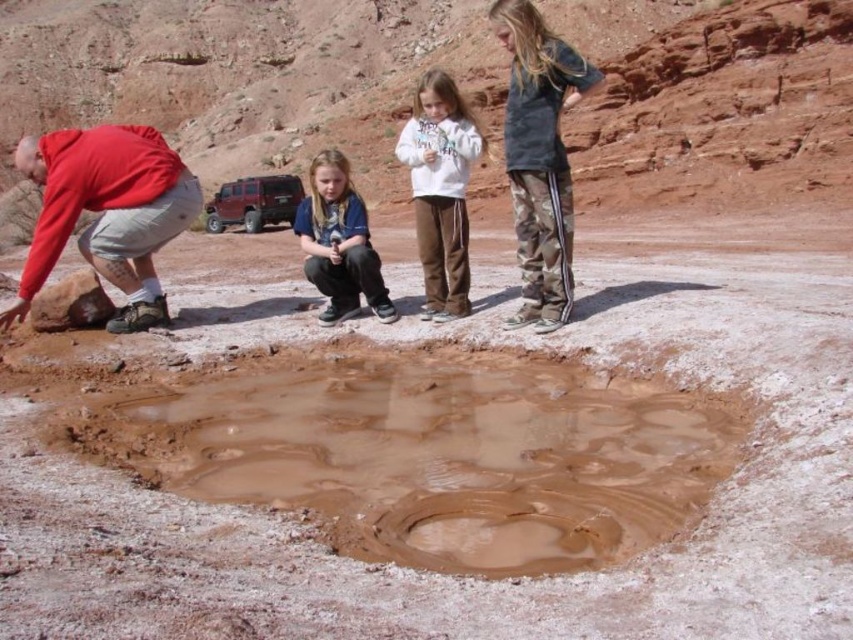
Is red matte shirt at lower left to the right of camo pants at right from the viewer's perspective?

No, red matte shirt at lower left is not to the right of camo pants at right.

Which is below, red matte shirt at lower left or camo pants at right?

red matte shirt at lower left

Which is in front, point (96, 237) or point (544, 64)?

Point (544, 64) is in front.

The width and height of the screenshot is (853, 640). I want to click on red matte shirt at lower left, so click(x=106, y=211).

Measure the distance between point (579,445) and camera.

A distance of 33.25 meters exists between point (579,445) and camera.

What do you see at coordinates (432, 452) in the screenshot? Image resolution: width=853 pixels, height=640 pixels. I see `muddy wet puddle at center` at bounding box center [432, 452].

Between point (258, 369) and point (329, 180), which one is positioned in front?

Point (258, 369) is more forward.

This screenshot has width=853, height=640. What are the coordinates of `muddy wet puddle at center` in the screenshot? It's located at (432, 452).

Which of these two, muddy wet puddle at center or camo pants at right, stands taller?

camo pants at right

Which is in front, point (590, 506) or point (502, 28)?

Positioned in front is point (590, 506).

The height and width of the screenshot is (640, 853). Identify the location of muddy wet puddle at center. (432, 452).